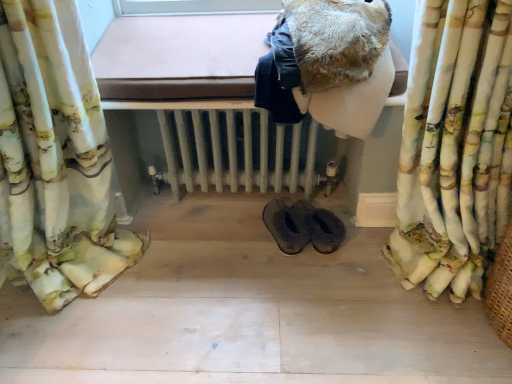
This screenshot has width=512, height=384. Identify the location of vacant space to the left of fuzzy brown blanket at upper center. (198, 56).